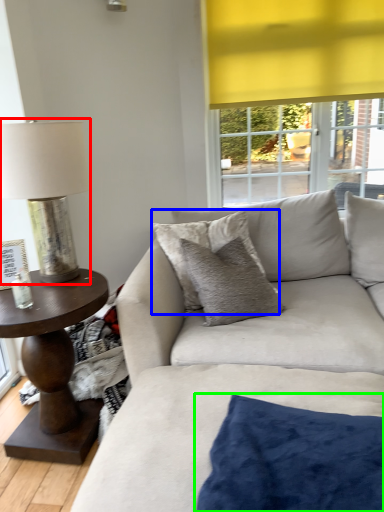
Question: Which object is positioned farthest from table lamp (highlighted by a red box)? Select from pillow (highlighted by a blue box) and pillow (highlighted by a green box).

Choices:
 (A) pillow
 (B) pillow

Answer: (B)